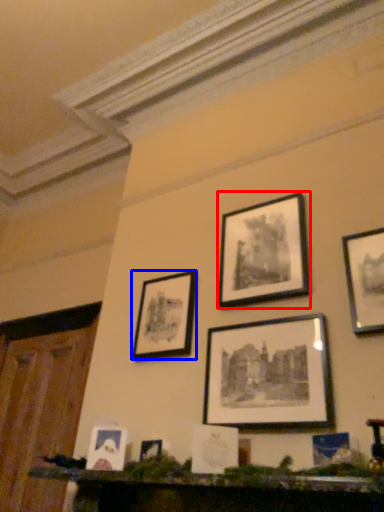
Question: Which object appears farthest to the camera in this image, picture frame (highlighted by a red box) or picture frame (highlighted by a blue box)?

Choices:
 (A) picture frame
 (B) picture frame

Answer: (B)